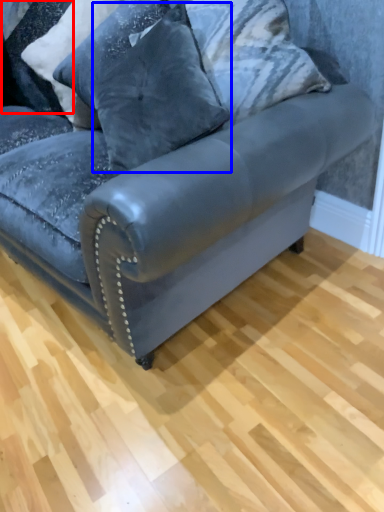
Question: Which object is closer to the camera taking this photo, pillow (highlighted by a red box) or pillow (highlighted by a blue box)?

Choices:
 (A) pillow
 (B) pillow

Answer: (B)